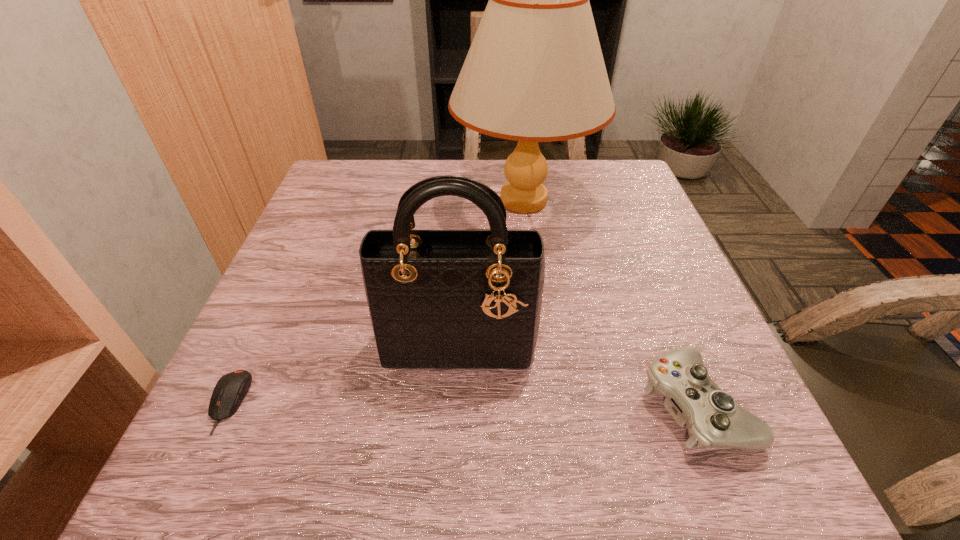
The image size is (960, 540). I want to click on object at the far edge, so click(x=535, y=72).

Identify the location of object that is at the near edge. This screenshot has height=540, width=960. coord(713,419).

You are a GUI agent. You are given a task and a screenshot of the screen. Output one action in this format:
    pyautogui.click(x=<x>, y=<y>)
    Task: Click on the object present at the left edge
    This screenshot has height=540, width=960.
    Given the screenshot: What is the action you would take?
    point(230,390)

I want to click on lampshade that is at the right edge, so click(535, 72).

I want to click on control that is at the right edge, so click(713, 419).

Image resolution: width=960 pixels, height=540 pixels. I want to click on object present at the far right corner, so click(x=535, y=72).

At what (x,y) coordinates should I click in order to perform the action: click on object present at the near right corner. Please return your answer as a coordinate pair (x, y). Looking at the image, I should click on (713, 419).

Find the location of a particular element. vacant space at the far edge is located at coordinates (409, 163).

Image resolution: width=960 pixels, height=540 pixels. I want to click on free region at the near edge of the desktop, so click(492, 458).

In the image, there is a desktop. In order to click on blank space at the left edge in this screenshot , I will do `click(239, 429)`.